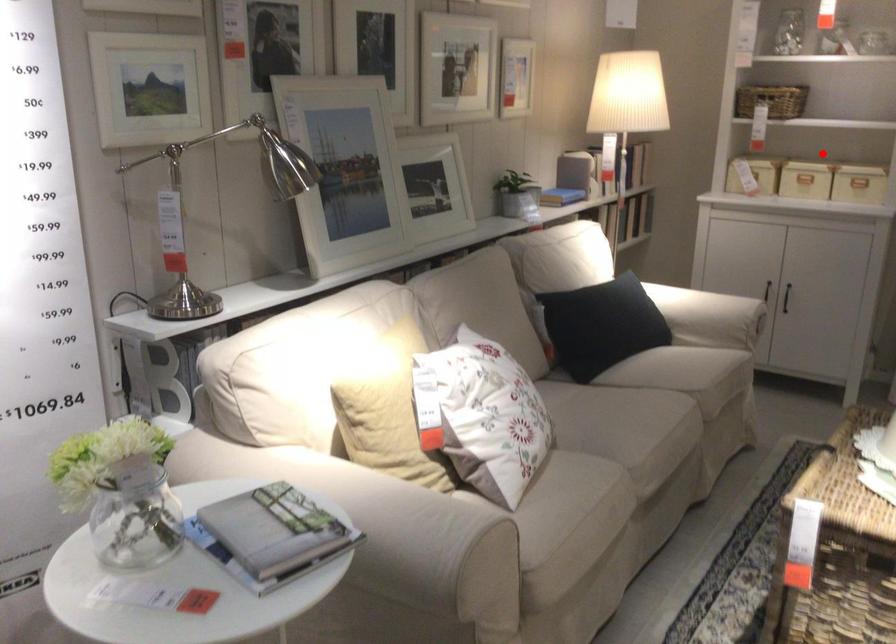
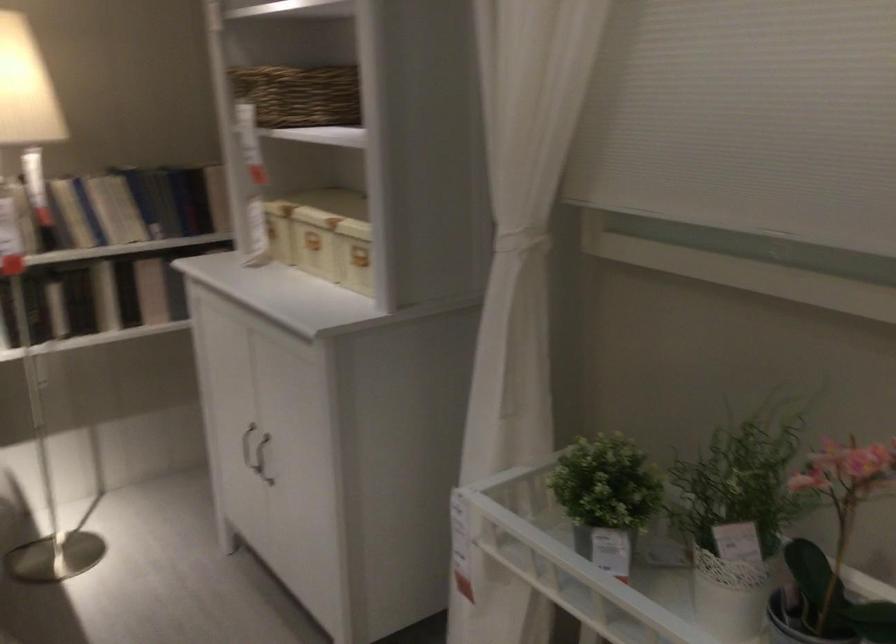
Find the pixel in the second image that matches the highlighted location in the first image.

(314, 242)